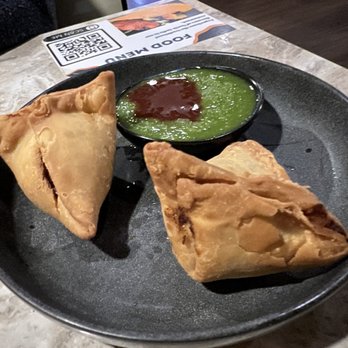
Locate an element on the screen. The width and height of the screenshot is (348, 348). sauce bowl is located at coordinates (247, 125).